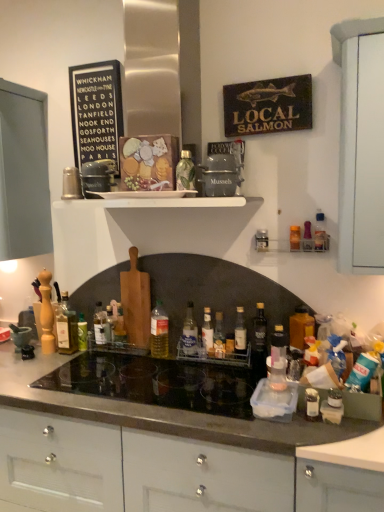
Question: Which direction should I rotate to face green glass bottle at center, the second bottle viewed from the left, — up or down?

Choices:
 (A) down
 (B) up

Answer: (A)

Question: Considering the relative sizes of clear glass bottle at center, which is the sixth bottle in left-to-right order, and translucent plastic bottle at center, placed as the eleventh bottle when sorted from left to right, in the image provided, is clear glass bottle at center, which is the sixth bottle in left-to-right order, shorter than translucent plastic bottle at center, placed as the eleventh bottle when sorted from left to right,?

Choices:
 (A) no
 (B) yes

Answer: (A)

Question: Is clear glass bottle at center, placed as the seventh bottle when sorted from right to left, closer to the viewer compared to translucent plastic bottle at center, which appears as the second bottle when viewed from the right?

Choices:
 (A) no
 (B) yes

Answer: (A)

Question: Does clear glass bottle at center, which is the sixth bottle in left-to-right order, have a greater height compared to translucent plastic bottle at center, placed as the eleventh bottle when sorted from left to right?

Choices:
 (A) no
 (B) yes

Answer: (B)

Question: Is clear glass bottle at center, placed as the seventh bottle when sorted from right to left, smaller than translucent plastic bottle at center, which appears as the second bottle when viewed from the right?

Choices:
 (A) no
 (B) yes

Answer: (A)

Question: From a real-world perspective, is clear glass bottle at center, which is the sixth bottle in left-to-right order, below translucent plastic bottle at center, which appears as the second bottle when viewed from the right?

Choices:
 (A) no
 (B) yes

Answer: (B)

Question: Is clear glass bottle at center, which is the sixth bottle in left-to-right order, turned away from translucent plastic bottle at center, which appears as the second bottle when viewed from the right?

Choices:
 (A) no
 (B) yes

Answer: (A)

Question: Is matte gray container at center directly adjacent to translucent glass bottle at center, which is the eighth bottle in left-to-right order?

Choices:
 (A) yes
 (B) no

Answer: (B)

Question: Are matte gray container at center and translucent glass bottle at center, which is the eighth bottle in left-to-right order, far apart?

Choices:
 (A) yes
 (B) no

Answer: (B)

Question: Can you confirm if matte gray container at center is positioned to the left of translucent glass bottle at center, which is the fifth bottle from right to left?

Choices:
 (A) no
 (B) yes

Answer: (B)

Question: Does matte gray container at center have a lesser width compared to translucent glass bottle at center, which is the fifth bottle from right to left?

Choices:
 (A) no
 (B) yes

Answer: (A)

Question: Is matte gray container at center oriented towards translucent glass bottle at center, which is the fifth bottle from right to left?

Choices:
 (A) no
 (B) yes

Answer: (A)

Question: From the image's perspective, is matte gray container at center under translucent glass bottle at center, which is the eighth bottle in left-to-right order?

Choices:
 (A) yes
 (B) no

Answer: (B)

Question: Is the depth of translucent glass bottle at center, which is the fifth bottle from right to left, less than that of translucent glass bottle at left, which is the 12th bottle from right to left?

Choices:
 (A) no
 (B) yes

Answer: (B)